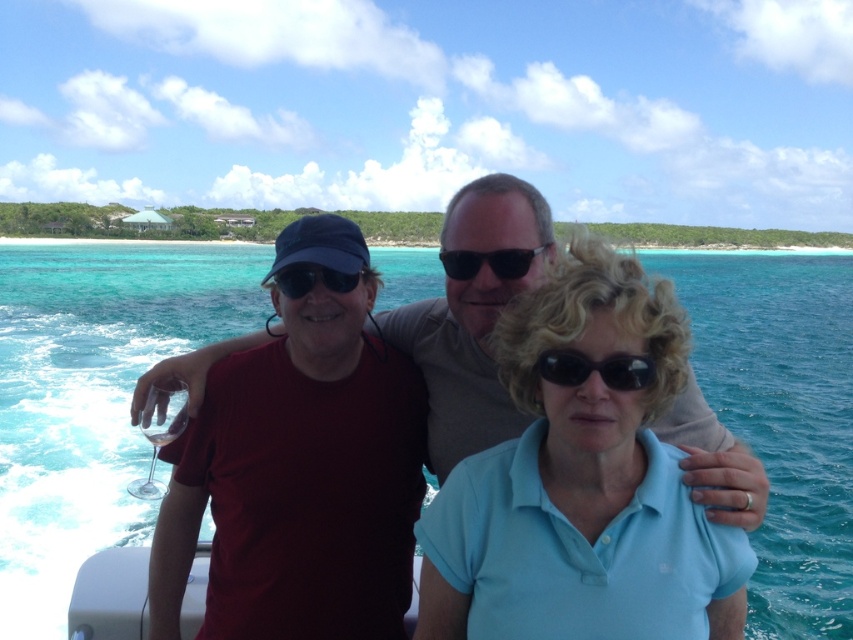
Between point (96, 433) and point (604, 374), which one is positioned in front?

Positioned in front is point (604, 374).

Can you confirm if clear blue water at center is thinner than black reflective sunglasses at center?

Incorrect, clear blue water at center's width is not less than black reflective sunglasses at center's.

This screenshot has height=640, width=853. What do you see at coordinates (91, 396) in the screenshot?
I see `clear blue water at center` at bounding box center [91, 396].

Identify the location of clear blue water at center. The width and height of the screenshot is (853, 640). (91, 396).

Which is more to the right, matte red shirt at center or matte black goggles at center?

matte black goggles at center is more to the right.

Can you confirm if matte red shirt at center is positioned above matte black goggles at center?

No, matte red shirt at center is not above matte black goggles at center.

The width and height of the screenshot is (853, 640). Describe the element at coordinates (300, 468) in the screenshot. I see `matte red shirt at center` at that location.

I want to click on matte red shirt at center, so click(300, 468).

Can you confirm if clear blue water at center is thinner than matte black goggles at center?

No.

Which of these two, clear blue water at center or matte black goggles at center, stands taller?

With more height is clear blue water at center.

Between point (39, 460) and point (318, 268), which one is positioned behind?

Point (39, 460)

Find the location of `clear blue water at center`. clear blue water at center is located at coordinates (91, 396).